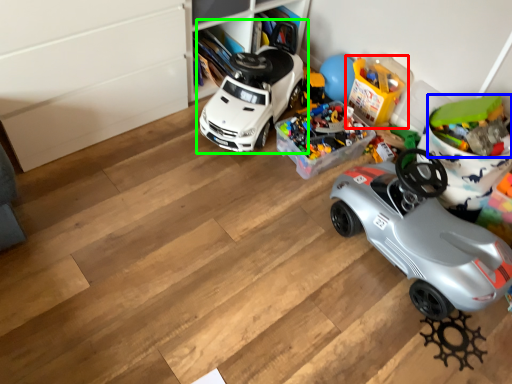
Question: Which object is the farthest from toy (highlighted by a red box)? Choose among these: toy (highlighted by a blue box) or car (highlighted by a green box).

Choices:
 (A) toy
 (B) car

Answer: (A)